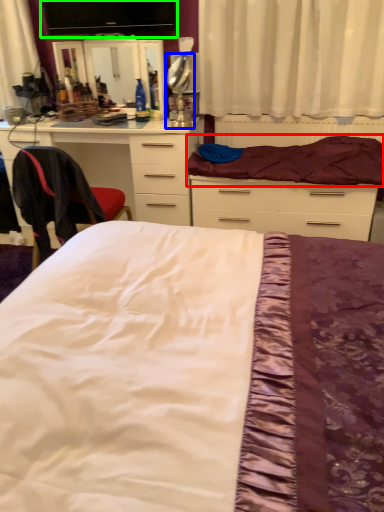
Question: Estimate the real-world distances between objects in this image. Which object is farther from mattress (highlighted by a red box), table lamp (highlighted by a blue box) or computer monitor (highlighted by a green box)?

Choices:
 (A) table lamp
 (B) computer monitor

Answer: (B)